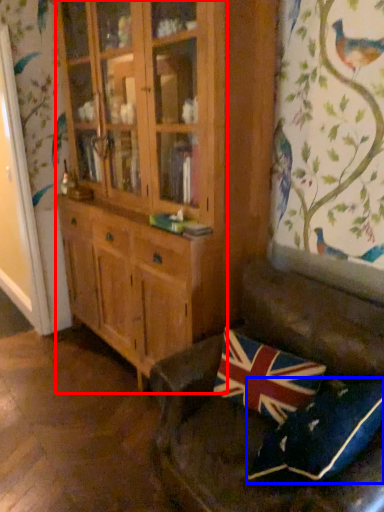
Question: Which object is closer to the camera taking this photo, cabinetry (highlighted by a red box) or pillow (highlighted by a blue box)?

Choices:
 (A) cabinetry
 (B) pillow

Answer: (B)